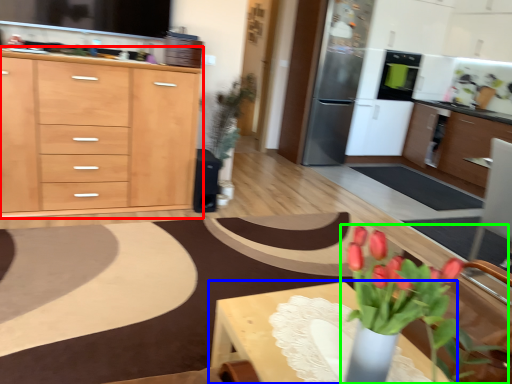
Question: Which is nearer to the cabinetry (highlighted by a red box)? table (highlighted by a blue box) or houseplant (highlighted by a green box).

Choices:
 (A) table
 (B) houseplant

Answer: (A)